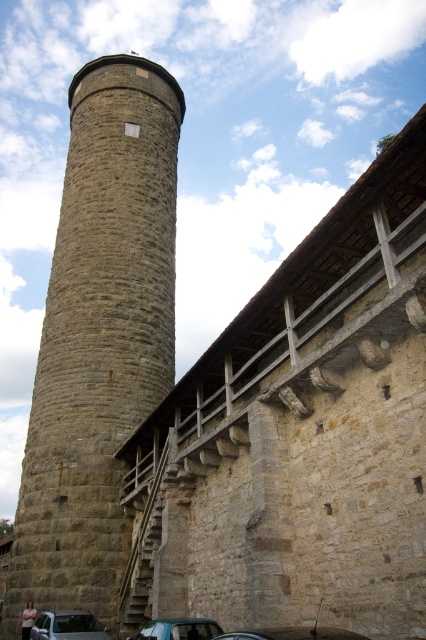
Question: Estimate the real-world distances between objects in this image. Which object is closer to the metallic silver car at lower left?

Choices:
 (A) metallic silver car at lower center
 (B) stone water tower at center
 (C) metallic blue car at lower center

Answer: (C)

Question: Which object is positioned farthest from the metallic silver car at lower center?

Choices:
 (A) stone water tower at center
 (B) metallic silver car at lower left
 (C) metallic blue car at lower center

Answer: (A)

Question: Which object is farther from the camera taking this photo?

Choices:
 (A) metallic silver car at lower center
 (B) metallic blue car at lower center
 (C) metallic silver car at lower left
 (D) stone water tower at center

Answer: (D)

Question: Is metallic silver car at lower left to the right of metallic silver car at lower center from the viewer's perspective?

Choices:
 (A) yes
 (B) no

Answer: (B)

Question: Does stone water tower at center have a larger size compared to metallic silver car at lower center?

Choices:
 (A) yes
 (B) no

Answer: (A)

Question: Does metallic blue car at lower center have a lesser width compared to metallic silver car at lower center?

Choices:
 (A) yes
 (B) no

Answer: (B)